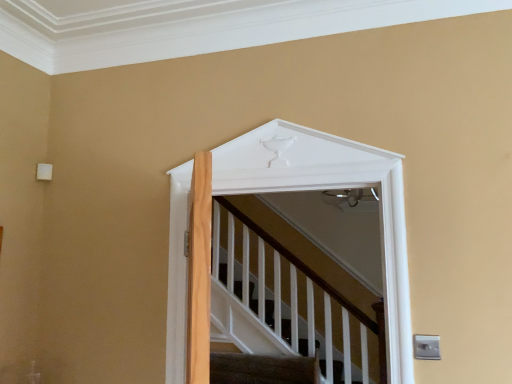
The height and width of the screenshot is (384, 512). What do you see at coordinates (262, 369) in the screenshot?
I see `carpeted stairs at lower center` at bounding box center [262, 369].

At what (x,y) coordinates should I click in order to perform the action: click on carpeted stairs at lower center. Please return your answer as a coordinate pair (x, y). Looking at the image, I should click on (262, 369).

Measure the distance between point (231, 379) and camera.

Point (231, 379) is 3.11 meters away from camera.

This screenshot has height=384, width=512. I want to click on white matte door at upper center, so click(331, 188).

Describe the element at coordinates (331, 188) in the screenshot. I see `white matte door at upper center` at that location.

At what (x,y) coordinates should I click in order to perform the action: click on carpeted stairs at lower center. Please return your answer as a coordinate pair (x, y). Looking at the image, I should click on (262, 369).

Between white matte door at upper center and carpeted stairs at lower center, which one appears on the left side from the viewer's perspective?

carpeted stairs at lower center is more to the left.

Which object is more forward, white matte door at upper center or carpeted stairs at lower center?

Positioned in front is white matte door at upper center.

Considering the positions of points (379, 162) and (285, 376), is point (379, 162) closer to camera compared to point (285, 376)?

That is True.

From the image's perspective, which one is positioned higher, white matte door at upper center or carpeted stairs at lower center?

white matte door at upper center is shown above in the image.

From a real-world perspective, does white matte door at upper center stand above carpeted stairs at lower center?

Indeed, from a real-world perspective, white matte door at upper center stands above carpeted stairs at lower center.

Considering the sizes of objects white matte door at upper center and carpeted stairs at lower center in the image provided, who is wider, white matte door at upper center or carpeted stairs at lower center?

carpeted stairs at lower center.

Who is shorter, white matte door at upper center or carpeted stairs at lower center?

carpeted stairs at lower center is shorter.

Considering the sizes of objects white matte door at upper center and carpeted stairs at lower center in the image provided, who is bigger, white matte door at upper center or carpeted stairs at lower center?

white matte door at upper center is bigger.

Is white matte door at upper center inside or outside of carpeted stairs at lower center?

white matte door at upper center exists outside the volume of carpeted stairs at lower center.

Is white matte door at upper center not close to carpeted stairs at lower center?

white matte door at upper center is far away from carpeted stairs at lower center.

Is white matte door at upper center oriented away from carpeted stairs at lower center?

Answer: Yes, white matte door at upper center's orientation is away from carpeted stairs at lower center.

What's the angular difference between white matte door at upper center and carpeted stairs at lower center's facing directions?

There is a 0.465-degree angle between the facing directions of white matte door at upper center and carpeted stairs at lower center.

Measure the distance between white matte door at upper center and carpeted stairs at lower center.

1.68 meters.

This screenshot has height=384, width=512. I want to click on stairs that appears below the white matte door at upper center (from the image's perspective), so click(x=262, y=369).

From the picture: Considering the positions of objects carpeted stairs at lower center and white matte door at upper center in the image provided, who is more to the left, carpeted stairs at lower center or white matte door at upper center?

From the viewer's perspective, carpeted stairs at lower center appears more on the left side.

Between carpeted stairs at lower center and white matte door at upper center, which one is positioned behind?

Positioned behind is carpeted stairs at lower center.

Which is nearer, (316, 361) or (380, 166)?

Point (316, 361) appears to be farther away from the viewer than point (380, 166).

From the image's perspective, who appears lower, carpeted stairs at lower center or white matte door at upper center?

From the image's view, carpeted stairs at lower center is below.

From a real-world perspective, is carpeted stairs at lower center over white matte door at upper center?

No, from a real-world perspective, carpeted stairs at lower center is not over white matte door at upper center

Considering the relative sizes of carpeted stairs at lower center and white matte door at upper center in the image provided, is carpeted stairs at lower center thinner than white matte door at upper center?

Incorrect, the width of carpeted stairs at lower center is not less than that of white matte door at upper center.

Which of these two, carpeted stairs at lower center or white matte door at upper center, stands shorter?

Standing shorter between the two is carpeted stairs at lower center.

Looking at this image, considering the relative sizes of carpeted stairs at lower center and white matte door at upper center in the image provided, is carpeted stairs at lower center bigger than white matte door at upper center?

Incorrect, carpeted stairs at lower center is not larger than white matte door at upper center.

Could white matte door at upper center be considered to be inside carpeted stairs at lower center?

No, white matte door at upper center is not a part of carpeted stairs at lower center.

Is carpeted stairs at lower center far from white matte door at upper center?

Yes, carpeted stairs at lower center is far from white matte door at upper center.

Is carpeted stairs at lower center oriented away from white matte door at upper center?

No.

How many degrees apart are the facing directions of carpeted stairs at lower center and white matte door at upper center?

The facing directions of carpeted stairs at lower center and white matte door at upper center are 0.465 degrees apart.

The height and width of the screenshot is (384, 512). I want to click on stairs on the left side of white matte door at upper center, so click(262, 369).

Locate an element on the screen. The height and width of the screenshot is (384, 512). elevator in front of the carpeted stairs at lower center is located at coordinates (331, 188).

This screenshot has width=512, height=384. In order to click on elevator above the carpeted stairs at lower center (from a real-world perspective) in this screenshot , I will do `click(331, 188)`.